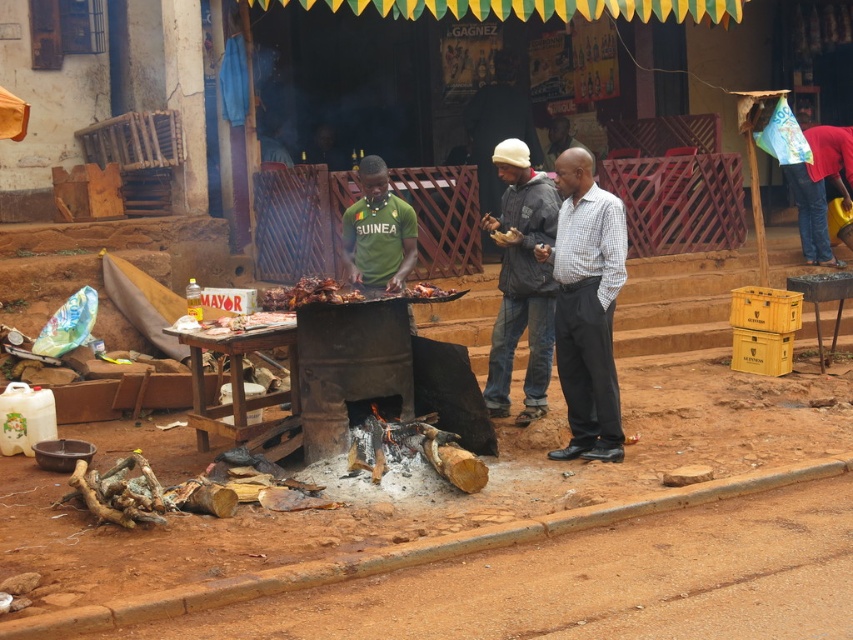
Is green matte shirt at center above brown crispy meat at center?

Correct, green matte shirt at center is located above brown crispy meat at center.

Which is behind, point (350, 241) or point (358, 298)?

Positioned behind is point (350, 241).

You are a GUI agent. You are given a task and a screenshot of the screen. Output one action in this format:
    pyautogui.click(x=<x>, y=<y>)
    Task: Click on the green matte shirt at center
    This screenshot has height=640, width=853.
    Given the screenshot: What is the action you would take?
    pyautogui.click(x=378, y=232)

Based on the photo, is white checkered shirt at center shorter than gray woolen jacket at center?

Yes.

I want to click on white checkered shirt at center, so click(585, 307).

The image size is (853, 640). I want to click on white checkered shirt at center, so click(585, 307).

Does point (514, 292) come behind point (347, 292)?

Yes, it is.

Based on the photo, which is more to the right, gray woolen jacket at center or brown crispy meat at center?

gray woolen jacket at center is more to the right.

Does point (482, 392) come closer to viewer compared to point (268, 300)?

That is False.

Where is `gray woolen jacket at center`? The image size is (853, 640). gray woolen jacket at center is located at coordinates (521, 282).